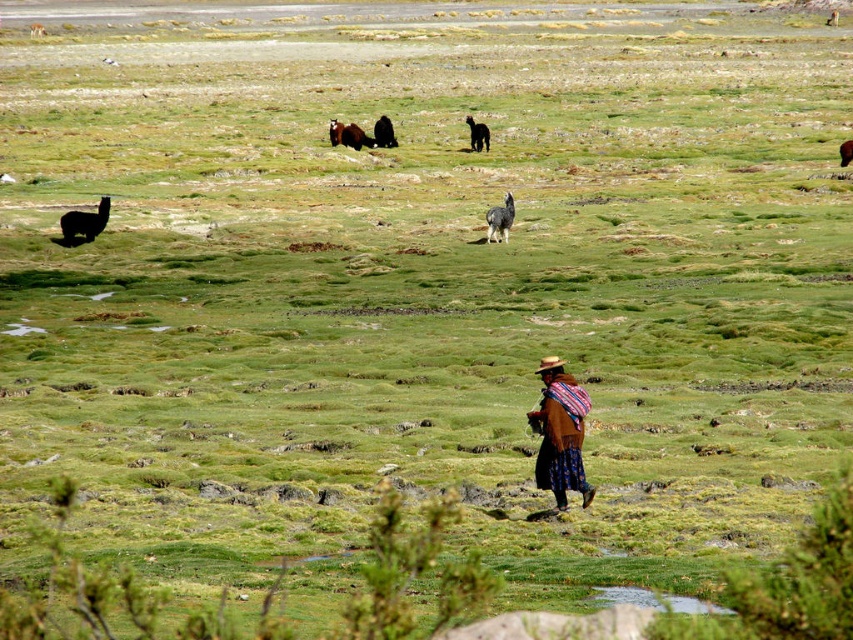
Does brown woven hat at center appear over dark brown woolen llama at upper center?

No.

Can you confirm if brown woven hat at center is positioned to the left of dark brown woolen llama at upper center?

No, brown woven hat at center is not to the left of dark brown woolen llama at upper center.

Between point (589, 499) and point (376, 140), which one is positioned behind?

Point (376, 140)

You are a GUI agent. You are given a task and a screenshot of the screen. Output one action in this format:
    pyautogui.click(x=<x>, y=<y>)
    Task: Click on the brown woven hat at center
    This screenshot has height=640, width=853.
    Given the screenshot: What is the action you would take?
    pyautogui.click(x=560, y=433)

Is brown woven hat at center in front of brown woolen alpaca at upper center?

Yes, it is.

Does brown woven hat at center appear on the left side of brown woolen alpaca at upper center?

In fact, brown woven hat at center is to the right of brown woolen alpaca at upper center.

Image resolution: width=853 pixels, height=640 pixels. Find the location of `brown woven hat at center`. brown woven hat at center is located at coordinates (560, 433).

Can you confirm if brown woven hat at center is bigger than black woolen llama at left?

No.

Does brown woven hat at center appear on the left side of black woolen llama at left?

No, brown woven hat at center is not to the left of black woolen llama at left.

Image resolution: width=853 pixels, height=640 pixels. Find the location of `brown woven hat at center`. brown woven hat at center is located at coordinates (560, 433).

At what (x,y) coordinates should I click in order to perform the action: click on brown woven hat at center. Please return your answer as a coordinate pair (x, y). Looking at the image, I should click on (560, 433).